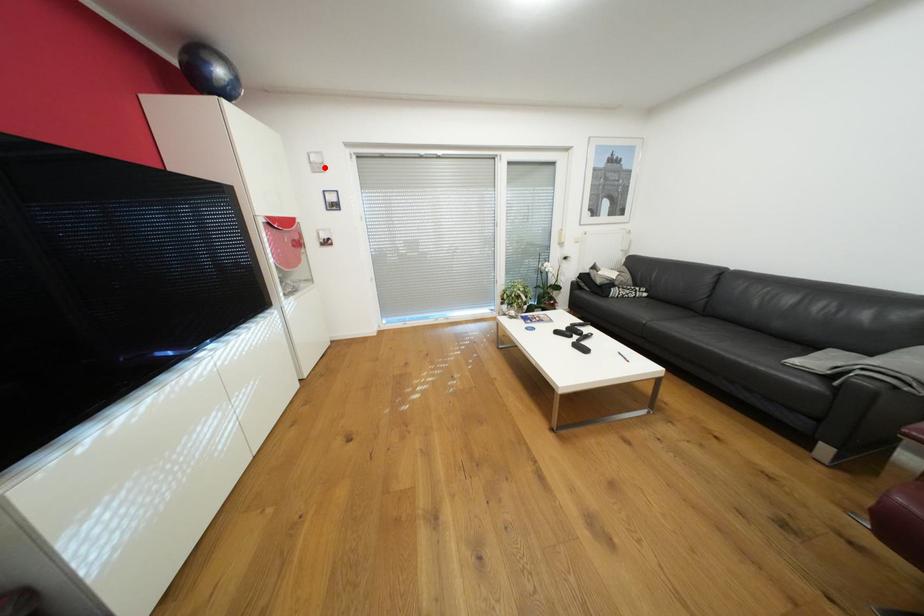
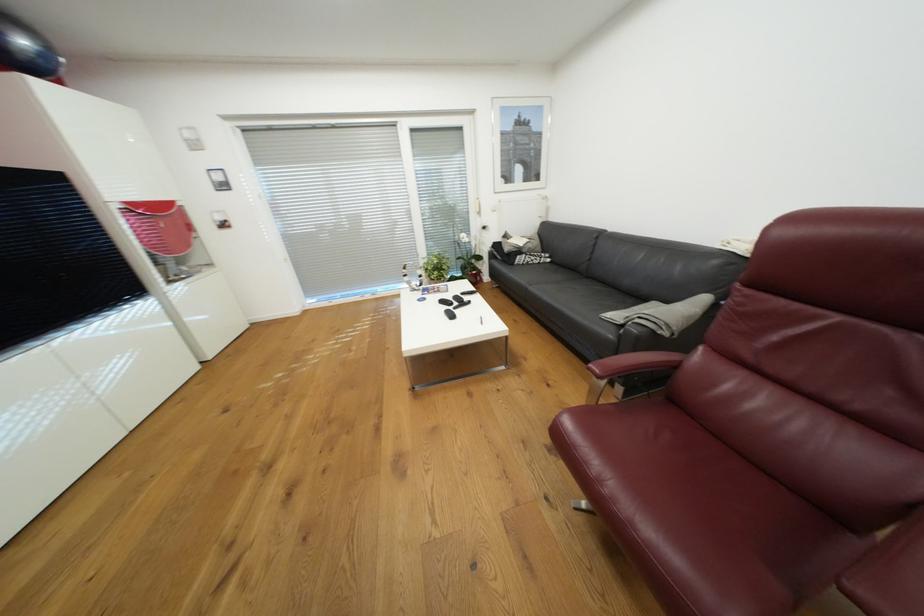
Question: I am providing you with two images of the same scene from different viewpoints. Given a red point in image1, look at the same physical point in image2. Is it:

Choices:
 (A) Closer to the viewpoint
 (B) Farther from the viewpoint

Answer: (B)